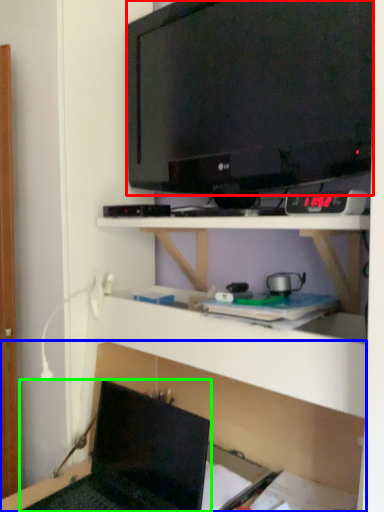
Question: Based on their relative distances, which object is nearer to television (highlighted by a red box)? Choose from shelf (highlighted by a blue box) and laptop (highlighted by a green box).

Choices:
 (A) shelf
 (B) laptop

Answer: (A)